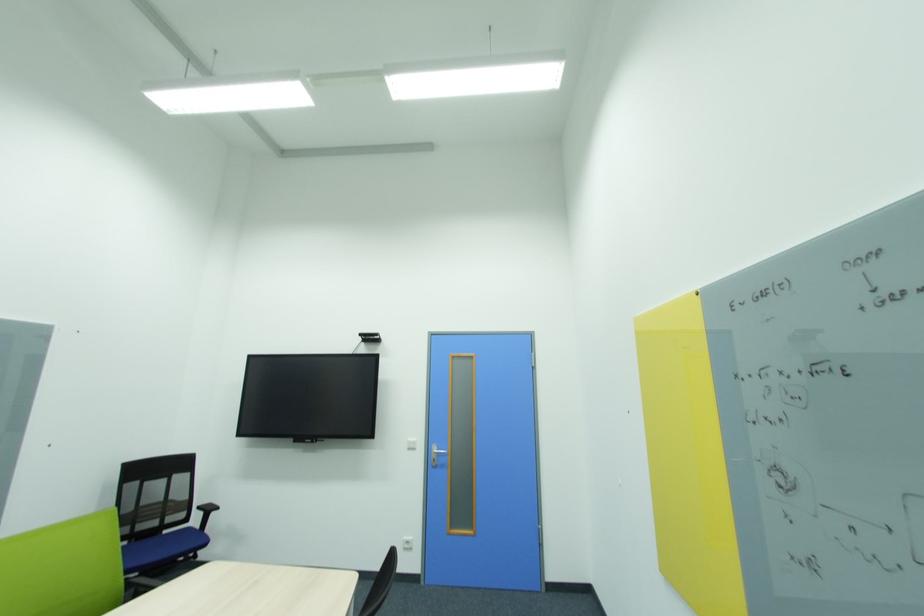
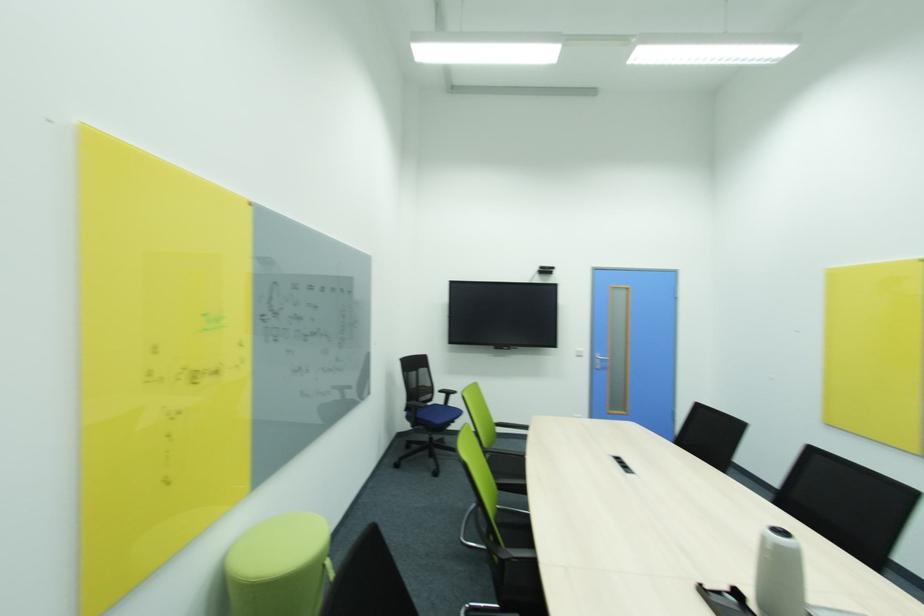
Where in the second image is the point corresponding to the point at 439,466 from the first image?

(602, 368)